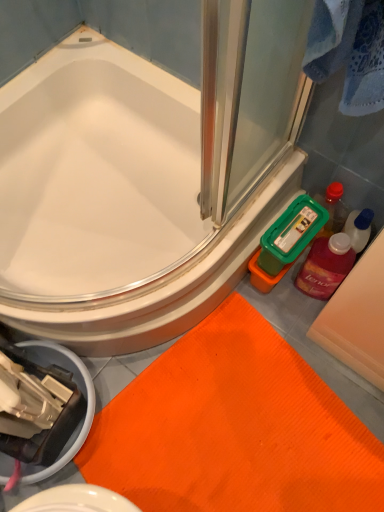
Question: From a real-world perspective, is translucent plastic mouthwash at right below orange textured bath mat at lower center?

Choices:
 (A) no
 (B) yes

Answer: (A)

Question: Considering the relative sizes of translucent plastic mouthwash at right and orange textured bath mat at lower center in the image provided, is translucent plastic mouthwash at right taller than orange textured bath mat at lower center?

Choices:
 (A) no
 (B) yes

Answer: (B)

Question: From the image's perspective, is translucent plastic mouthwash at right over orange textured bath mat at lower center?

Choices:
 (A) no
 (B) yes

Answer: (B)

Question: Considering the relative sizes of translucent plastic mouthwash at right and orange textured bath mat at lower center in the image provided, is translucent plastic mouthwash at right smaller than orange textured bath mat at lower center?

Choices:
 (A) yes
 (B) no

Answer: (A)

Question: Can orange textured bath mat at lower center be found inside translucent plastic mouthwash at right?

Choices:
 (A) yes
 (B) no

Answer: (B)

Question: Considering the positions of point (342, 248) and point (193, 431), is point (342, 248) closer or farther from the camera than point (193, 431)?

Choices:
 (A) farther
 (B) closer

Answer: (B)

Question: Considering the positions of translucent plastic mouthwash at right and orange textured bath mat at lower center in the image, is translucent plastic mouthwash at right wider or thinner than orange textured bath mat at lower center?

Choices:
 (A) wide
 (B) thin

Answer: (B)

Question: From a real-world perspective, is translucent plastic mouthwash at right physically located above or below orange textured bath mat at lower center?

Choices:
 (A) below
 (B) above

Answer: (B)

Question: Is translucent plastic mouthwash at right taller or shorter than orange textured bath mat at lower center?

Choices:
 (A) tall
 (B) short

Answer: (A)

Question: Considering the positions of orange textured bath mat at lower center and white glossy bathtub at upper left in the image, is orange textured bath mat at lower center taller or shorter than white glossy bathtub at upper left?

Choices:
 (A) tall
 (B) short

Answer: (B)

Question: From a real-world perspective, relative to white glossy bathtub at upper left, is orange textured bath mat at lower center vertically above or below?

Choices:
 (A) below
 (B) above

Answer: (A)

Question: From the image's perspective, is orange textured bath mat at lower center located above or below white glossy bathtub at upper left?

Choices:
 (A) above
 (B) below

Answer: (B)

Question: Is point (117, 407) closer or farther from the camera than point (9, 222)?

Choices:
 (A) closer
 (B) farther

Answer: (A)

Question: In terms of height, does white glossy bathtub at upper left look taller or shorter compared to orange textured bath mat at lower center?

Choices:
 (A) short
 (B) tall

Answer: (B)

Question: Which is correct: white glossy bathtub at upper left is inside orange textured bath mat at lower center, or outside of it?

Choices:
 (A) inside
 (B) outside

Answer: (B)